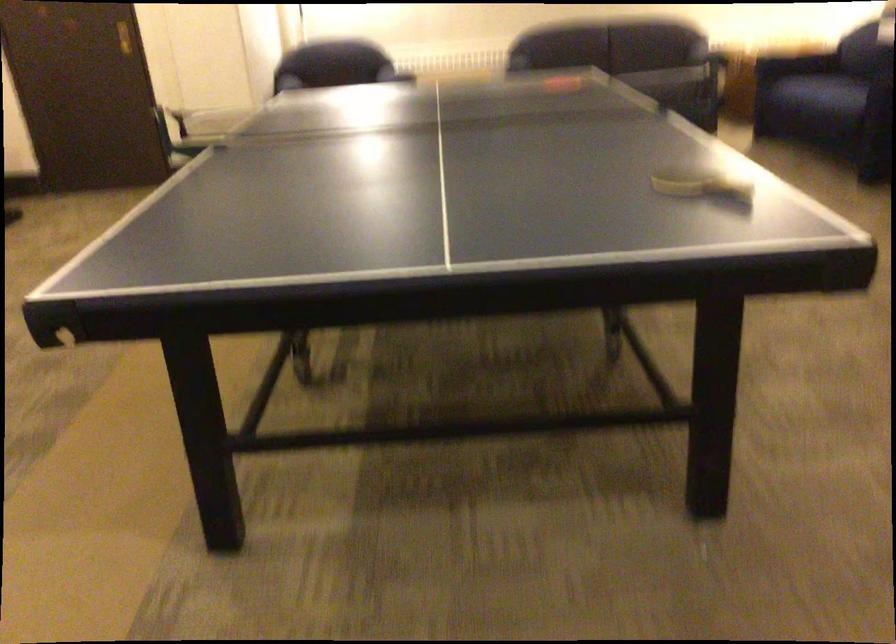
What do you see at coordinates (819, 105) in the screenshot? I see `a chair sitting surface` at bounding box center [819, 105].